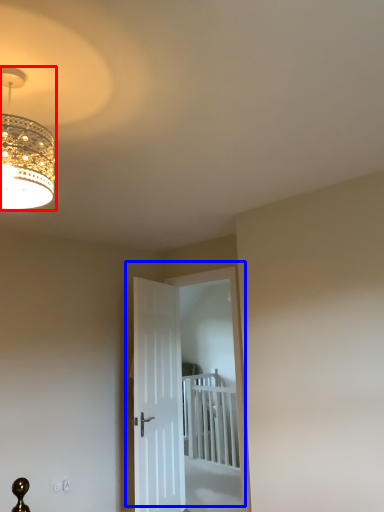
Question: Which point is closer to the camera, lamp (highlighted by a red box) or door (highlighted by a blue box)?

Choices:
 (A) lamp
 (B) door

Answer: (A)